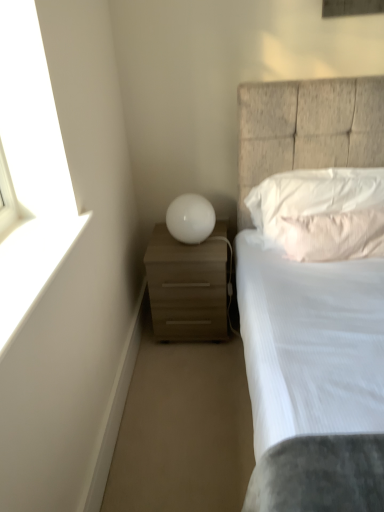
In order to click on vacant area on top of matte wood nightstand at lower left (from a real-world perspective) in this screenshot , I will do `click(180, 246)`.